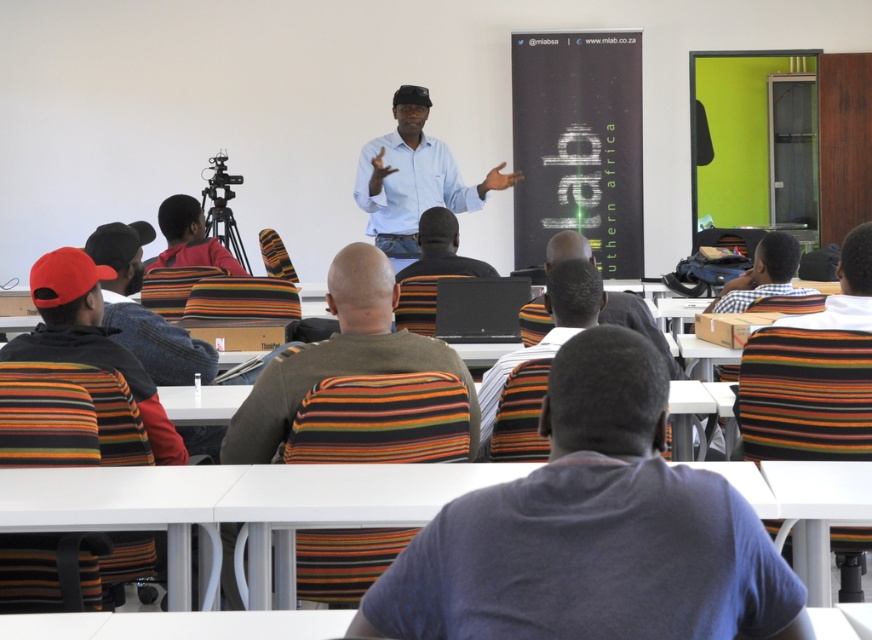
Question: Can you confirm if striped sweater at center is positioned to the right of blue shirt at center?

Choices:
 (A) no
 (B) yes

Answer: (A)

Question: Which object appears farthest from the camera in this image?

Choices:
 (A) matte black screen at upper center
 (B) striped shirt at center
 (C) blue shirt at center

Answer: (A)

Question: Which object is farther from the camera taking this photo?

Choices:
 (A) blue shirt at center
 (B) striped sweater at center

Answer: (A)

Question: From the image, what is the correct spatial relationship of blue shirt at center in relation to striped shirt at center?

Choices:
 (A) above
 (B) below

Answer: (A)

Question: Estimate the real-world distances between objects in this image. Which object is closer to the striped shirt at center?

Choices:
 (A) striped sweater at center
 (B) dark gray hoodie at center
 (C) blue shirt at center
 (D) matte black screen at upper center

Answer: (C)

Question: Can you confirm if striped sweater at center is smaller than striped shirt at center?

Choices:
 (A) yes
 (B) no

Answer: (B)